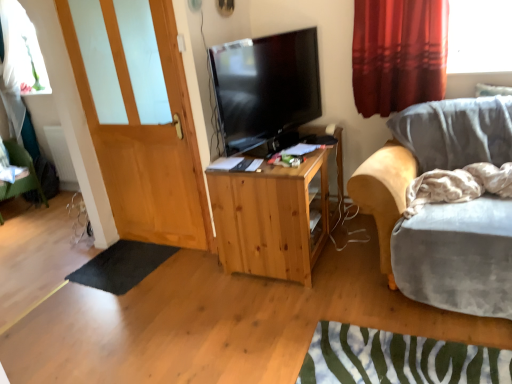
The height and width of the screenshot is (384, 512). Find the location of `vacant space in front of wooden door at left`. vacant space in front of wooden door at left is located at coordinates (156, 273).